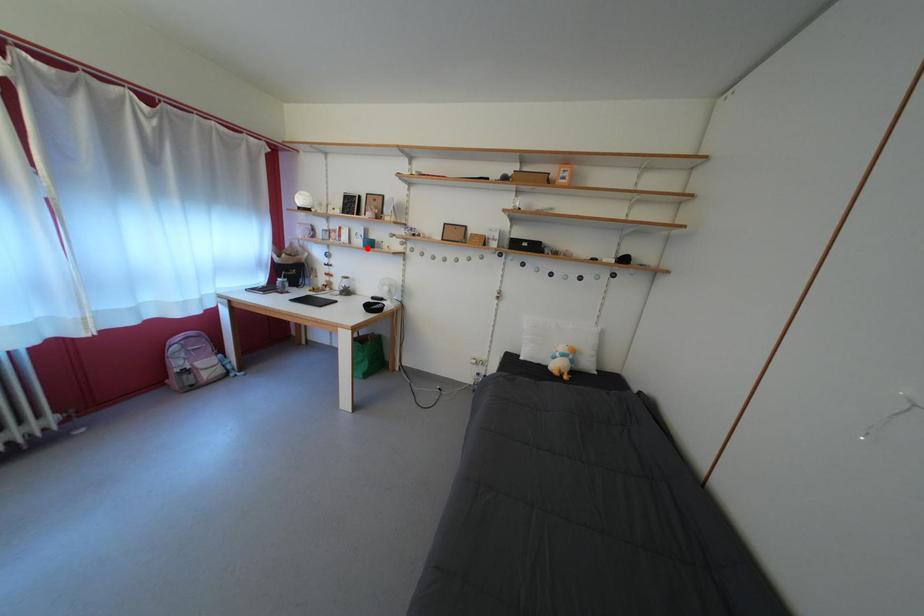
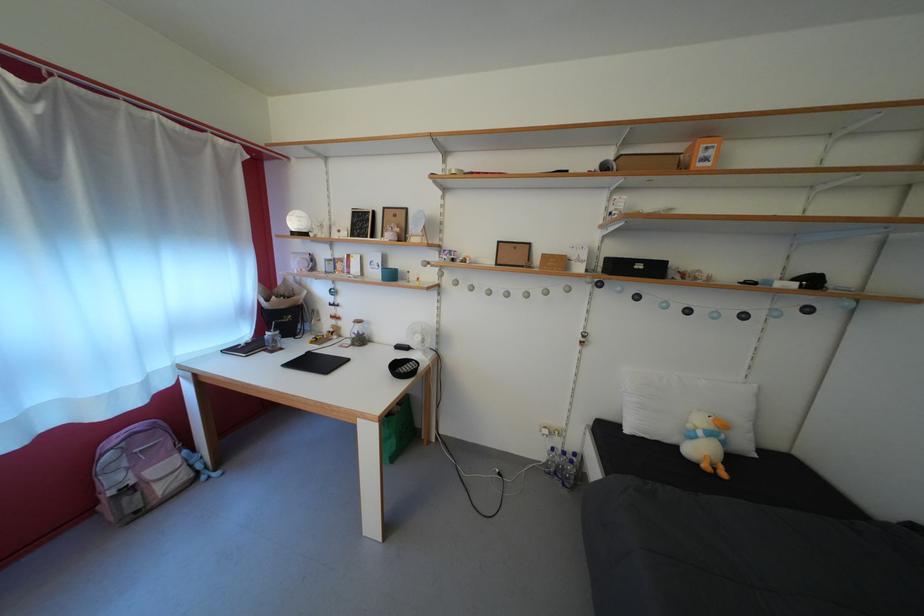
The point at the highlighted location is marked in the first image. Where is the corresponding point in the second image?

(383, 280)